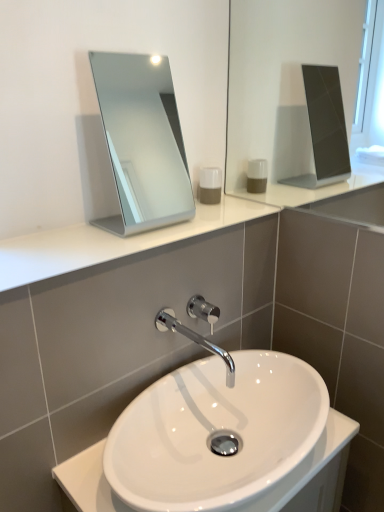
The width and height of the screenshot is (384, 512). I want to click on vacant space situated above white glossy countertop at upper center, positioned as the 2th counter top in bottom-to-top order (from a real-world perspective), so click(125, 234).